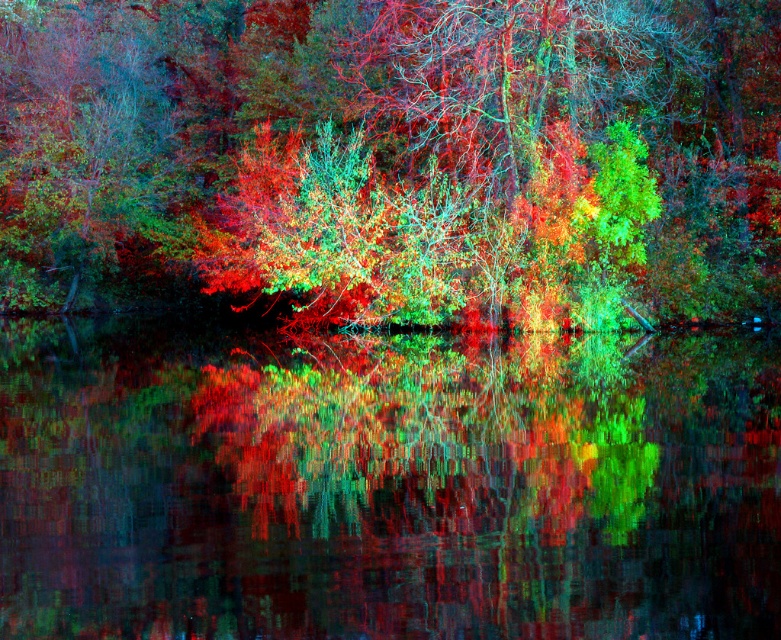
You are a painter standing at the edge of the water in the image. You want to capture the scene in your painting. Which object, the multicolored foliage at center or the reflective glass water at center, is positioned to the left side of the other?

The multicolored foliage at center is to the left of reflective glass water at center.

You are a painter standing at the edge of the water. You need to decide whether to paint the multicolored foliage at center or the reflective glass water at center first. Which object is wider so you can focus on capturing its full width in your painting?

The multicolored foliage at center might be wider than reflective glass water at center, so you should focus on painting the multicolored foliage at center first to capture its full width.

You are an artist trying to paint the scene. You want to ensure the multicolored foliage at center and reflective glass water at center are proportionally accurate. Which object should you paint larger?

The multicolored foliage at center should be painted larger because it is bigger than the reflective glass water at center according to the description.